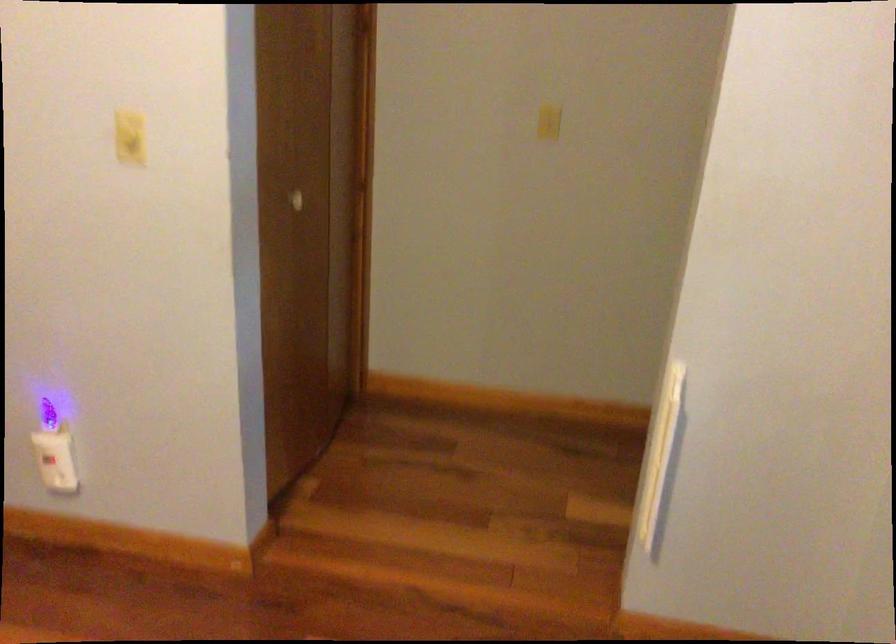
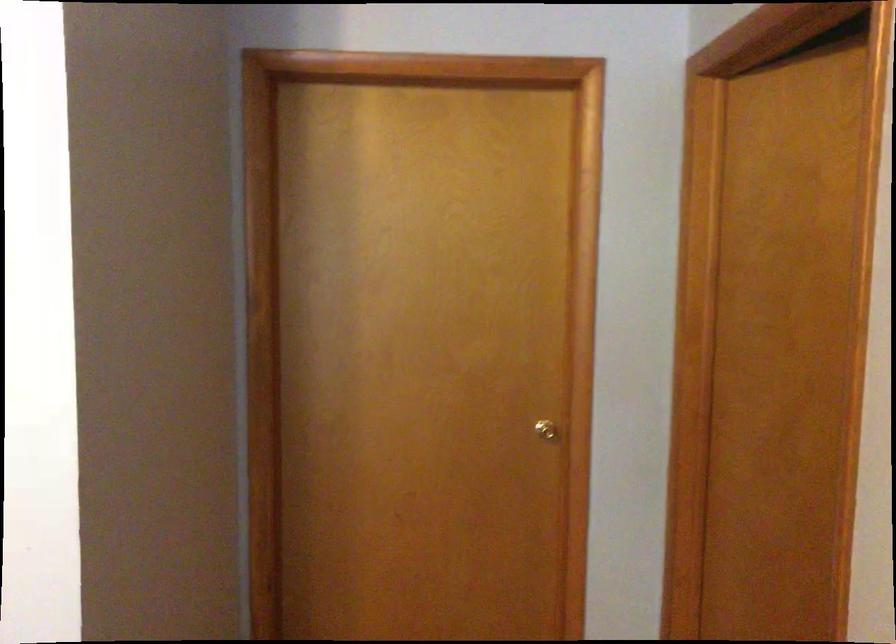
Question: The camera is either moving clockwise (left) or counter-clockwise (right) around the object. The first image is from the beginning of the video and the second image is from the end. Is the camera moving left or right when shooting the video?

Choices:
 (A) Left
 (B) Right

Answer: (B)